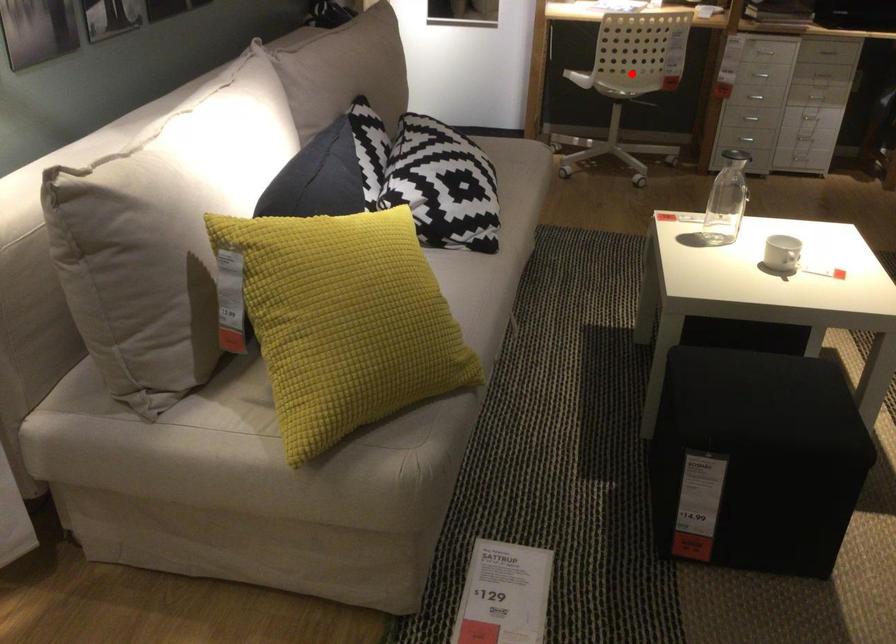
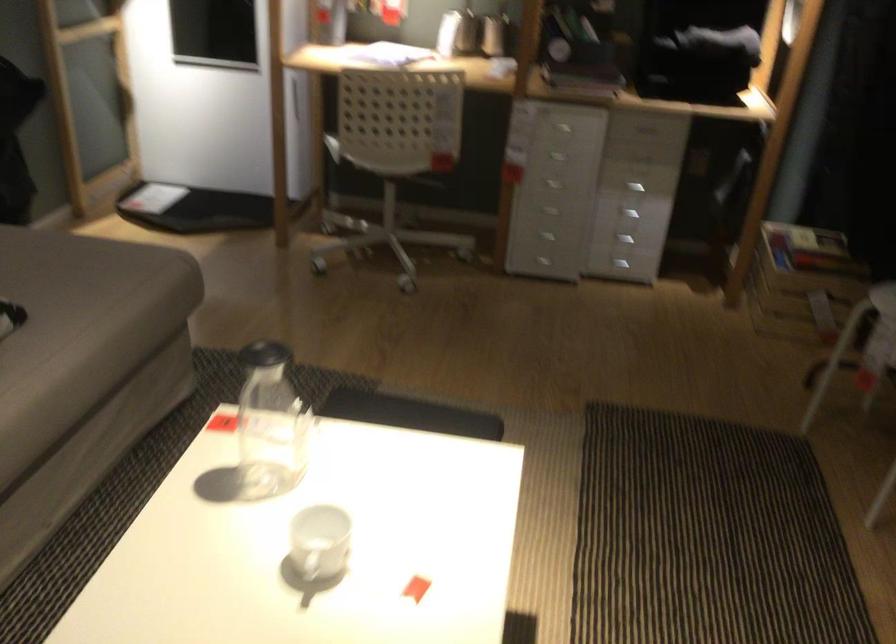
In the second image, find the point that corresponds to the highlighted location in the first image.

(388, 158)